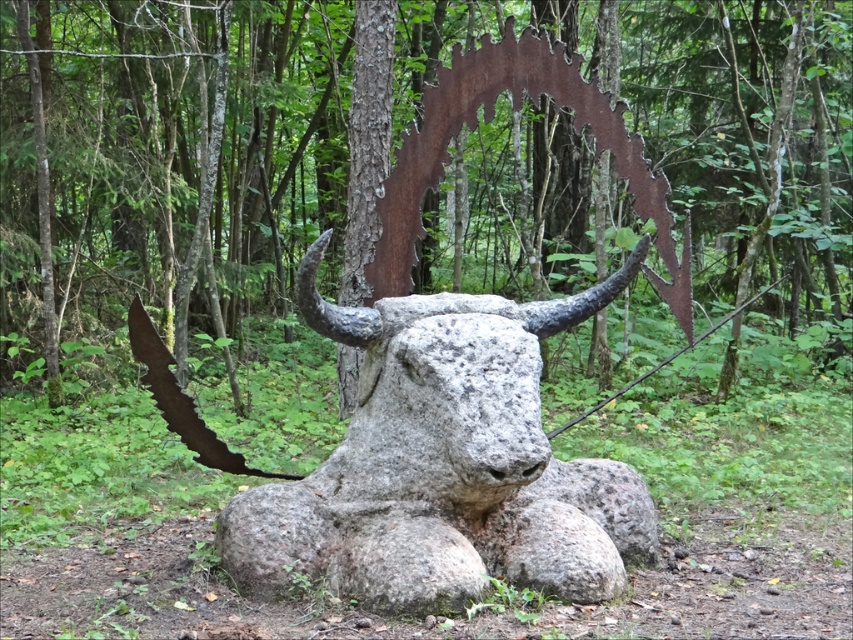
Can you confirm if rusty metal tree at center is taller than gray stone bull at center?

No.

Is rusty metal tree at center further to camera compared to gray stone bull at center?

Yes, it is behind gray stone bull at center.

Identify the location of rusty metal tree at center. The width and height of the screenshot is (853, 640). (743, 131).